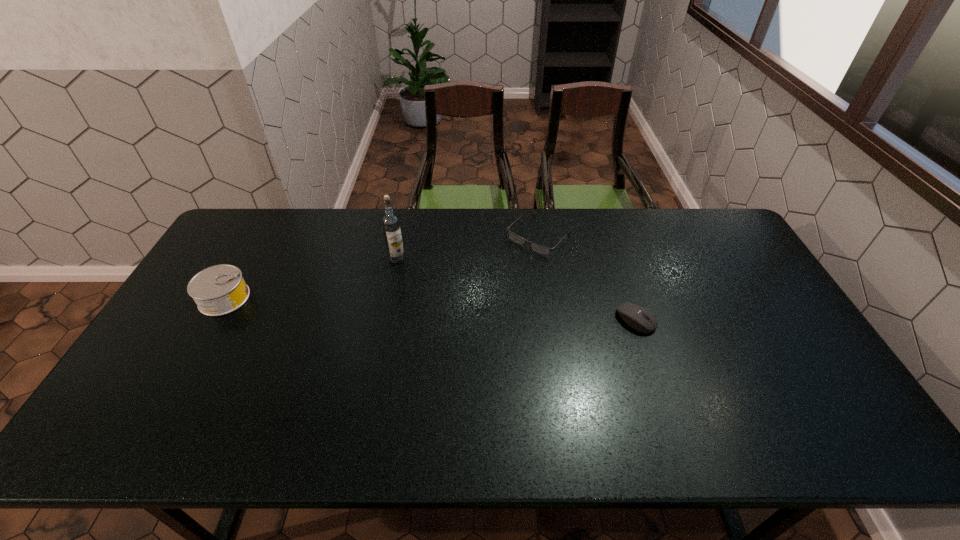
This screenshot has height=540, width=960. Identify the location of can. (218, 290).

Image resolution: width=960 pixels, height=540 pixels. In order to click on the third shortest object in this screenshot , I will do pos(218,290).

Locate an element on the screen. The width and height of the screenshot is (960, 540). computer equipment is located at coordinates (639, 318).

The height and width of the screenshot is (540, 960). In order to click on the second object from left to right in this screenshot , I will do `click(390, 222)`.

The image size is (960, 540). I want to click on vodka, so click(390, 222).

The image size is (960, 540). Find the location of `spectacles`. spectacles is located at coordinates (538, 248).

Locate an element on the screen. This screenshot has height=540, width=960. blank space located on the right of the can is located at coordinates (365, 299).

The image size is (960, 540). What are the coordinates of `vacant region located 0.360m on the right of the rightmost object` in the screenshot? It's located at (779, 319).

Find the location of `blank area located on the label of the second object from left to right`. blank area located on the label of the second object from left to right is located at coordinates (382, 282).

Find the location of a particular element. vacant area located on the label of the second object from left to right is located at coordinates (341, 350).